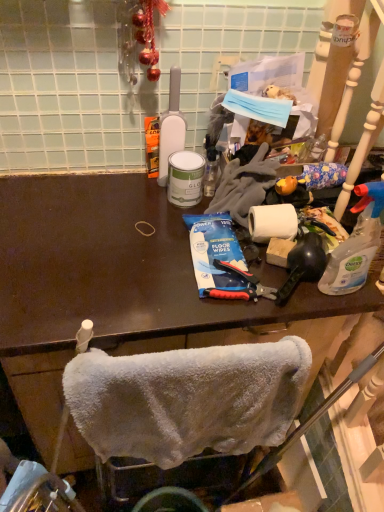
Locate an element on the screen. This screenshot has height=512, width=384. empty space that is ontop of blue plastic toothpaste at center (from a real-world perspective) is located at coordinates (219, 263).